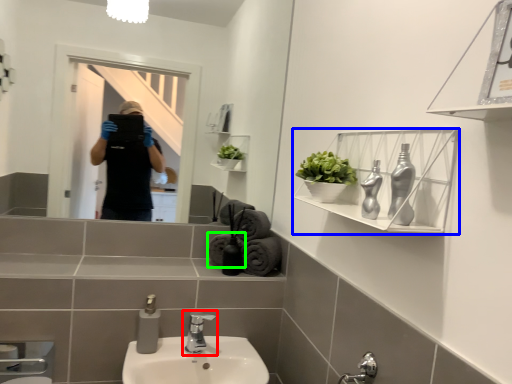
Question: Which is nearer to the tap (highlighted by a red box)? shelf (highlighted by a blue box) or bath towel (highlighted by a green box).

Choices:
 (A) shelf
 (B) bath towel

Answer: (B)